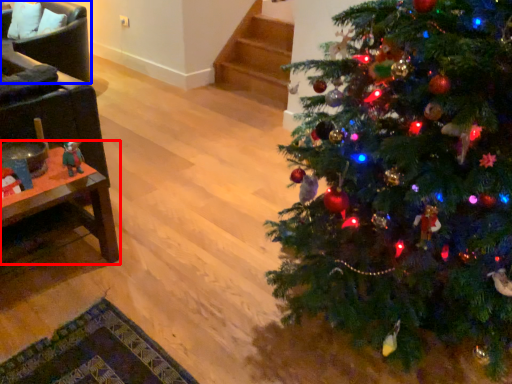
Question: Among these objects, which one is nearest to the camera, table (highlighted by a red box) or armchair (highlighted by a blue box)?

Choices:
 (A) table
 (B) armchair

Answer: (A)